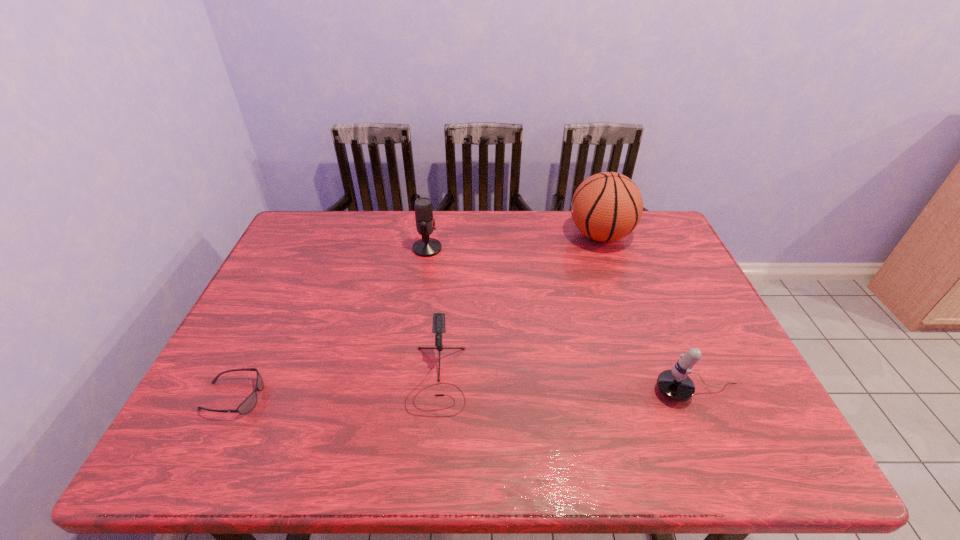
You are a GUI agent. You are given a task and a screenshot of the screen. Output one action in this format:
    pyautogui.click(x=<x>, y=<y>)
    Task: Click on the vacant area located on the side where the inflation valve is located
    This screenshot has width=960, height=540.
    Given the screenshot: What is the action you would take?
    pyautogui.click(x=546, y=235)

At what (x,y) coordinates should I click in order to perform the action: click on free space located 0.190m on the side of the tallest microphone with the red ring. Please return your answer as a coordinate pair (x, y). This screenshot has height=540, width=960. Looking at the image, I should click on (501, 248).

The height and width of the screenshot is (540, 960). I want to click on vacant space situated on the back of the rightmost microphone, so click(x=656, y=296).

Locate an element on the screen. The height and width of the screenshot is (540, 960). vacant position located on the stand of the second shortest object is located at coordinates (431, 448).

You are a GUI agent. You are given a task and a screenshot of the screen. Output one action in this format:
    pyautogui.click(x=<x>, y=<y>)
    Task: Click on the vacant region located 0.250m on the lenses of the leftmost object
    Image resolution: width=960 pixels, height=540 pixels.
    Given the screenshot: What is the action you would take?
    pyautogui.click(x=372, y=397)

The width and height of the screenshot is (960, 540). In order to click on basketball present at the far edge in this screenshot , I will do `click(607, 206)`.

You are a GUI agent. You are given a task and a screenshot of the screen. Output one action in this format:
    pyautogui.click(x=<x>, y=<y>)
    Task: Click on the microphone located at the far edge
    The width and height of the screenshot is (960, 540).
    Given the screenshot: What is the action you would take?
    pyautogui.click(x=426, y=247)

Identify the location of object located in the left edge section of the desktop. The height and width of the screenshot is (540, 960). (249, 403).

This screenshot has width=960, height=540. In order to click on basketball positioned at the right edge in this screenshot , I will do `click(607, 206)`.

Where is `microphone positioned at the right edge`? microphone positioned at the right edge is located at coordinates (674, 384).